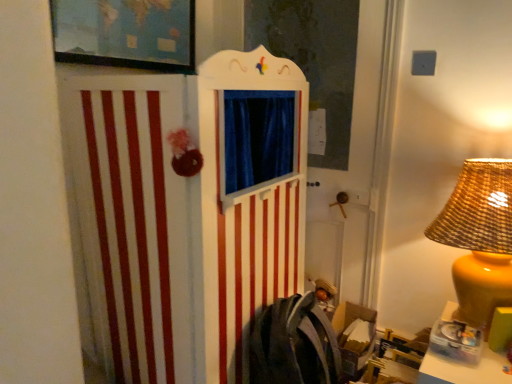
Question: Considering the positions of translucent plastic container at lower right and matte yellow lampshade at right in the image, is translucent plastic container at lower right taller or shorter than matte yellow lampshade at right?

Choices:
 (A) short
 (B) tall

Answer: (A)

Question: In the image, is translucent plastic container at lower right positioned in front of or behind matte yellow lampshade at right?

Choices:
 (A) front
 (B) behind

Answer: (A)

Question: Based on their relative distances, which object is nearer to the matte yellow lampshade at right?

Choices:
 (A) translucent plastic container at lower right
 (B) matte black picture frame at upper left

Answer: (A)

Question: Estimate the real-world distances between objects in this image. Which object is closer to the translucent plastic container at lower right?

Choices:
 (A) matte yellow lampshade at right
 (B) matte black picture frame at upper left

Answer: (A)